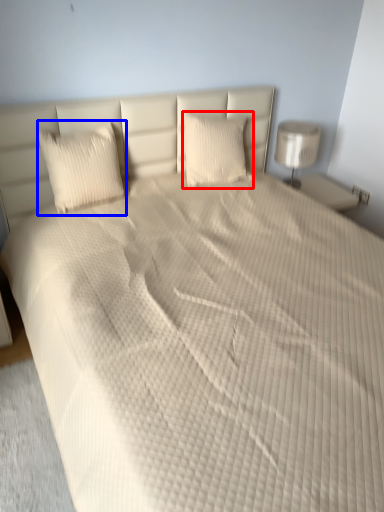
Question: Which of the following is the closest to the observer, pillow (highlighted by a red box) or pillow (highlighted by a blue box)?

Choices:
 (A) pillow
 (B) pillow

Answer: (B)